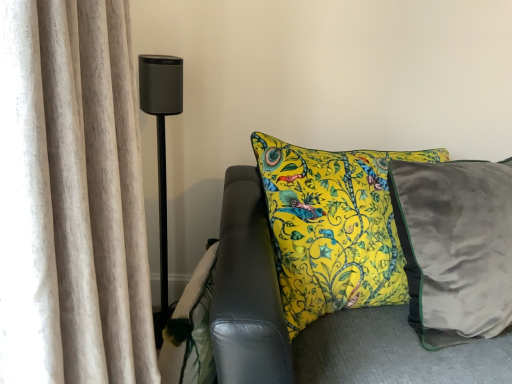
Question: From a real-world perspective, is matte black speaker at left on beige textured curtain at left?

Choices:
 (A) yes
 (B) no

Answer: (B)

Question: Is the depth of matte black speaker at left greater than that of beige textured curtain at left?

Choices:
 (A) no
 (B) yes

Answer: (B)

Question: From the image's perspective, would you say matte black speaker at left is positioned over beige textured curtain at left?

Choices:
 (A) no
 (B) yes

Answer: (B)

Question: Is matte black speaker at left shorter than beige textured curtain at left?

Choices:
 (A) no
 (B) yes

Answer: (A)

Question: Is matte black speaker at left outside of beige textured curtain at left?

Choices:
 (A) no
 (B) yes

Answer: (B)

Question: Is matte black speaker at left to the right of beige textured curtain at left from the viewer's perspective?

Choices:
 (A) no
 (B) yes

Answer: (A)

Question: Considering the relative sizes of beige textured curtain at left and matte black speaker at left in the image provided, is beige textured curtain at left smaller than matte black speaker at left?

Choices:
 (A) no
 (B) yes

Answer: (A)

Question: Is there a large distance between beige textured curtain at left and matte black speaker at left?

Choices:
 (A) yes
 (B) no

Answer: (B)

Question: Considering the relative sizes of beige textured curtain at left and matte black speaker at left in the image provided, is beige textured curtain at left bigger than matte black speaker at left?

Choices:
 (A) yes
 (B) no

Answer: (A)

Question: Is beige textured curtain at left turned away from matte black speaker at left?

Choices:
 (A) yes
 (B) no

Answer: (B)

Question: From a real-world perspective, is beige textured curtain at left on top of matte black speaker at left?

Choices:
 (A) no
 (B) yes

Answer: (B)

Question: From the image's perspective, is beige textured curtain at left located above matte black speaker at left?

Choices:
 (A) no
 (B) yes

Answer: (A)

Question: From their relative heights in the image, would you say beige textured curtain at left is taller or shorter than matte black speaker at left?

Choices:
 (A) tall
 (B) short

Answer: (B)